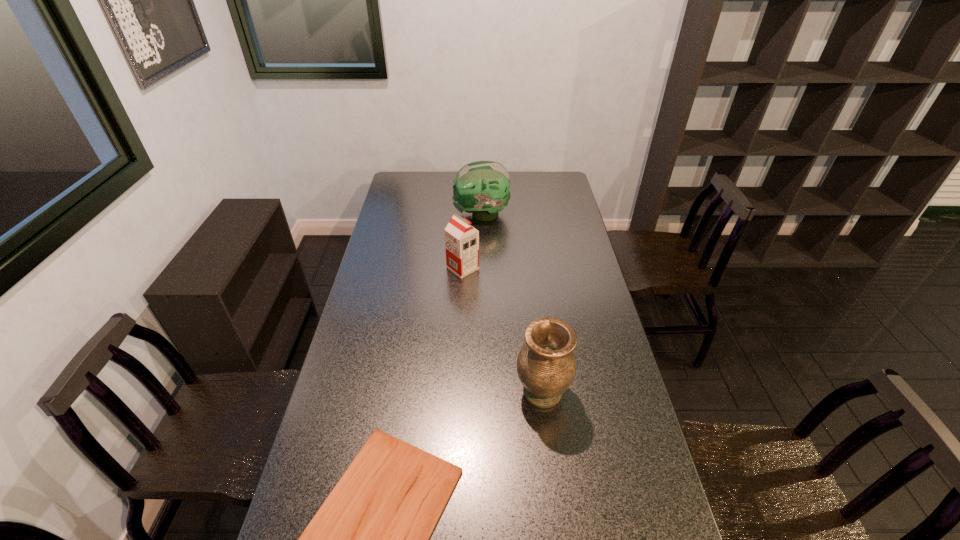
The width and height of the screenshot is (960, 540). In order to click on the farthest object in this screenshot , I will do `click(482, 188)`.

You are a GUI agent. You are given a task and a screenshot of the screen. Output one action in this format:
    pyautogui.click(x=<x>, y=<y>)
    Task: Click on the second nearest object
    This screenshot has height=540, width=960.
    Given the screenshot: What is the action you would take?
    pyautogui.click(x=546, y=365)

Locate an element on the screen. soya milk is located at coordinates (461, 239).

Where is `blank area located on the visor of the football helmet`? The image size is (960, 540). blank area located on the visor of the football helmet is located at coordinates (392, 214).

I want to click on vacant region located on the visor of the football helmet, so click(421, 214).

This screenshot has height=540, width=960. Identify the location of vacant point located on the visor of the football helmet. (420, 214).

What are the coordinates of `free space located on the left of the third farthest object` in the screenshot? It's located at (475, 392).

Image resolution: width=960 pixels, height=540 pixels. In order to click on free spot located 0.390m on the back of the third nearest object in this screenshot , I will do `click(466, 208)`.

Where is `free space at the far edge of the desktop`? free space at the far edge of the desktop is located at coordinates (453, 186).

The height and width of the screenshot is (540, 960). What are the coordinates of `vacant area at the left edge of the desktop` in the screenshot? It's located at (373, 364).